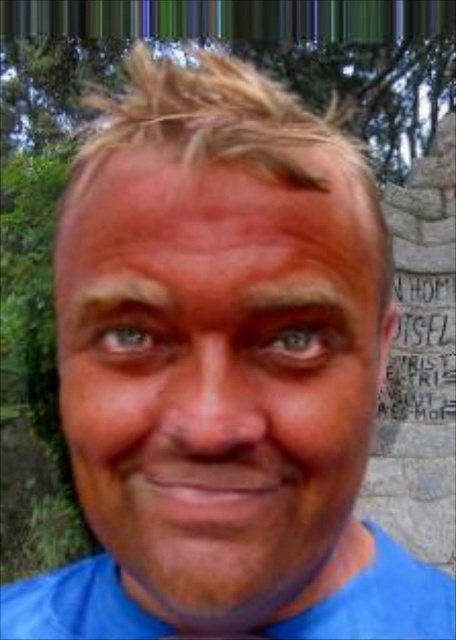
Does reddish skin at center have a greater height compared to blue cotton shirt at lower center?

No, reddish skin at center is not taller than blue cotton shirt at lower center.

Is point (179, 184) closer to camera compared to point (429, 611)?

Yes, it is.

Identify the location of reddish skin at center. The height and width of the screenshot is (640, 456). (232, 227).

Can you confirm if blue matte face at center is wider than brown matte eyebrow at upper center?

Correct, the width of blue matte face at center exceeds that of brown matte eyebrow at upper center.

Between point (153, 378) and point (299, 300), which one is positioned behind?

Point (299, 300)

What are the coordinates of `blue matte face at center` in the screenshot? It's located at (221, 385).

Is blue matte face at center positioned in front of brown hair at upper left?

That is True.

Between blue matte face at center and brown hair at upper left, which one is positioned higher?

brown hair at upper left is higher up.

Between point (242, 614) and point (135, 284), which one is positioned in front?

Point (135, 284) is in front.

What are the coordinates of `blue matte face at center` in the screenshot? It's located at (221, 385).